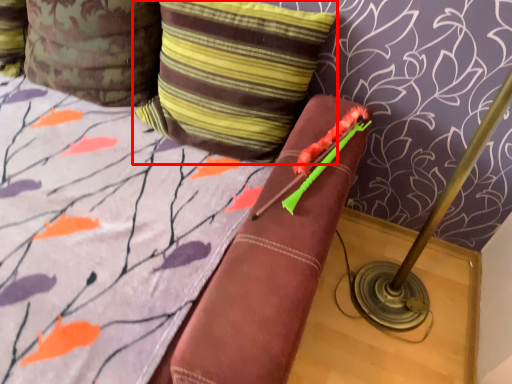
Question: From the image's perspective, considering the relative positions of pillow (annotated by the red box) and pillow in the image provided, where is pillow (annotated by the red box) located with respect to the staircase?

Choices:
 (A) below
 (B) above

Answer: (A)